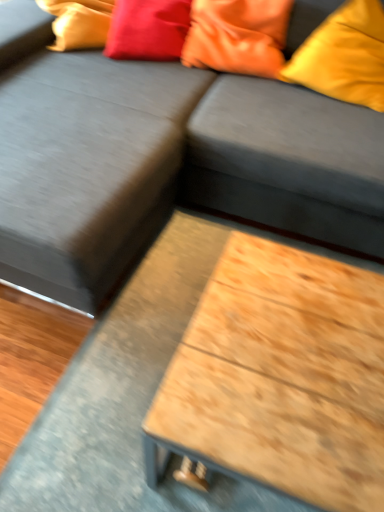
Question: From the image's perspective, is satin red pillow at upper center, the 3th pillow when ordered from right to left, on wooden table at center?

Choices:
 (A) no
 (B) yes

Answer: (B)

Question: Does satin red pillow at upper center, arranged as the 1th pillow when viewed from the left, lie behind wooden table at center?

Choices:
 (A) yes
 (B) no

Answer: (A)

Question: Is satin red pillow at upper center, the 3th pillow when ordered from right to left, placed right next to wooden table at center?

Choices:
 (A) no
 (B) yes

Answer: (A)

Question: Is satin red pillow at upper center, the 3th pillow when ordered from right to left, aimed at wooden table at center?

Choices:
 (A) no
 (B) yes

Answer: (A)

Question: Is satin red pillow at upper center, the 3th pillow when ordered from right to left, shorter than wooden table at center?

Choices:
 (A) yes
 (B) no

Answer: (B)

Question: Can you confirm if satin red pillow at upper center, the 3th pillow when ordered from right to left, is bigger than wooden table at center?

Choices:
 (A) yes
 (B) no

Answer: (A)

Question: Considering the relative positions of matte orange pillow at upper right, the first pillow positioned from the right, and wooden table at center in the image provided, is matte orange pillow at upper right, the first pillow positioned from the right, to the right of wooden table at center from the viewer's perspective?

Choices:
 (A) no
 (B) yes

Answer: (B)

Question: Does matte orange pillow at upper right, placed as the third pillow when sorted from left to right, lie in front of wooden table at center?

Choices:
 (A) no
 (B) yes

Answer: (A)

Question: Considering the relative positions of matte orange pillow at upper right, the first pillow positioned from the right, and wooden table at center in the image provided, is matte orange pillow at upper right, the first pillow positioned from the right, behind wooden table at center?

Choices:
 (A) no
 (B) yes

Answer: (B)

Question: Is matte orange pillow at upper right, the first pillow positioned from the right, not within wooden table at center?

Choices:
 (A) yes
 (B) no

Answer: (A)

Question: From the image's perspective, would you say matte orange pillow at upper right, placed as the third pillow when sorted from left to right, is positioned over wooden table at center?

Choices:
 (A) yes
 (B) no

Answer: (A)

Question: From a real-world perspective, is matte orange pillow at upper right, placed as the third pillow when sorted from left to right, positioned under wooden table at center based on gravity?

Choices:
 (A) yes
 (B) no

Answer: (B)

Question: Is wooden table at center not inside matte orange pillow at upper right, the first pillow positioned from the right?

Choices:
 (A) yes
 (B) no

Answer: (A)